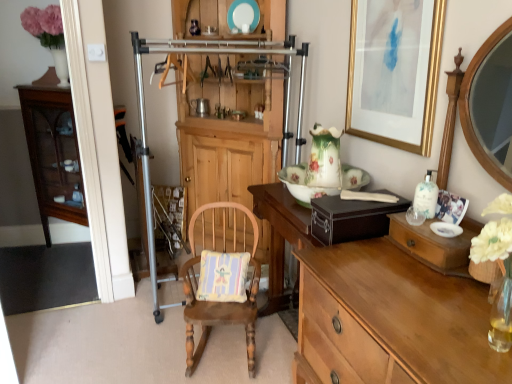
Find the location of a particular element. free space above light brown wood desk at center (from a real-world perspective) is located at coordinates (421, 301).